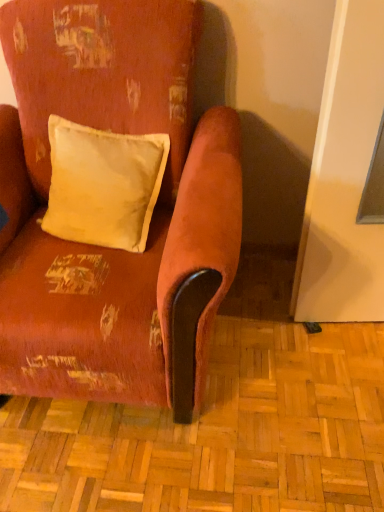
Image resolution: width=384 pixels, height=512 pixels. I want to click on distressed velvet armchair at center, so click(x=151, y=217).

What do you see at coordinates (151, 217) in the screenshot? I see `distressed velvet armchair at center` at bounding box center [151, 217].

Locate an element on the screen. The image size is (384, 512). matte yellow cushion at upper left is located at coordinates (103, 185).

Measure the distance between matte yellow cushion at upper left and camera.

A distance of 4.12 feet exists between matte yellow cushion at upper left and camera.

The height and width of the screenshot is (512, 384). What do you see at coordinates (103, 185) in the screenshot?
I see `matte yellow cushion at upper left` at bounding box center [103, 185].

Locate an element on the screen. distressed velvet armchair at center is located at coordinates (151, 217).

Can you confirm if matte yellow cushion at upper left is positioned to the left of distressed velvet armchair at center?

Incorrect, matte yellow cushion at upper left is not on the left side of distressed velvet armchair at center.

Considering the positions of objects matte yellow cushion at upper left and distressed velvet armchair at center in the image provided, who is in front, matte yellow cushion at upper left or distressed velvet armchair at center?

distressed velvet armchair at center is closer to the camera.

Is point (93, 161) behind point (94, 255)?

Yes, point (93, 161) is farther from viewer.

From the image's perspective, does matte yellow cushion at upper left appear higher than distressed velvet armchair at center?

Indeed, from the image's perspective, matte yellow cushion at upper left is shown above distressed velvet armchair at center.

From a real-world perspective, which object rests below the other?

distressed velvet armchair at center.

Is matte yellow cushion at upper left wider than distressed velvet armchair at center?

No, matte yellow cushion at upper left is not wider than distressed velvet armchair at center.

Does matte yellow cushion at upper left have a lesser height compared to distressed velvet armchair at center?

Yes.

Based on their sizes in the image, would you say matte yellow cushion at upper left is bigger or smaller than distressed velvet armchair at center?

In the image, matte yellow cushion at upper left appears to be smaller than distressed velvet armchair at center.

Is matte yellow cushion at upper left inside the boundaries of distressed velvet armchair at center, or outside?

matte yellow cushion at upper left is inside distressed velvet armchair at center.

Are matte yellow cushion at upper left and distressed velvet armchair at center located far from each other?

No, matte yellow cushion at upper left is in close proximity to distressed velvet armchair at center.

Is matte yellow cushion at upper left oriented away from distressed velvet armchair at center?

Yes, matte yellow cushion at upper left's orientation is away from distressed velvet armchair at center.

Measure the distance between matte yellow cushion at upper left and distressed velvet armchair at center.

matte yellow cushion at upper left and distressed velvet armchair at center are 6.63 inches apart.

Locate an element on the screen. This screenshot has height=512, width=384. pillow positioned vertically above the distressed velvet armchair at center (from a real-world perspective) is located at coordinates (103, 185).

Based on their positions, is distressed velvet armchair at center located to the left or right of matte yellow cushion at upper left?

distressed velvet armchair at center is to the left of matte yellow cushion at upper left.

Considering the positions of objects distressed velvet armchair at center and matte yellow cushion at upper left in the image provided, who is behind, distressed velvet armchair at center or matte yellow cushion at upper left?

Positioned behind is matte yellow cushion at upper left.

Is point (174, 30) closer or farther from the camera than point (112, 226)?

Clearly, point (174, 30) is closer to the camera than point (112, 226).

From the image's perspective, is distressed velvet armchair at center below matte yellow cushion at upper left?

Yes, from the image's perspective, distressed velvet armchair at center is below matte yellow cushion at upper left.

From a real-world perspective, is distressed velvet armchair at center physically located above or below matte yellow cushion at upper left?

distressed velvet armchair at center is below matte yellow cushion at upper left.

Considering the sizes of distressed velvet armchair at center and matte yellow cushion at upper left in the image, is distressed velvet armchair at center wider or thinner than matte yellow cushion at upper left?

Considering their sizes, distressed velvet armchair at center looks broader than matte yellow cushion at upper left.

Can you confirm if distressed velvet armchair at center is taller than matte yellow cushion at upper left?

Yes, distressed velvet armchair at center is taller than matte yellow cushion at upper left.

Can you confirm if distressed velvet armchair at center is smaller than matte yellow cushion at upper left?

Incorrect, distressed velvet armchair at center is not smaller in size than matte yellow cushion at upper left.

Is distressed velvet armchair at center spatially inside matte yellow cushion at upper left, or outside of it?

The correct answer is: outside.

Is distressed velvet armchair at center placed right next to matte yellow cushion at upper left?

No, distressed velvet armchair at center is not touching matte yellow cushion at upper left.

Is matte yellow cushion at upper left at the back of distressed velvet armchair at center?

Correct, distressed velvet armchair at center is looking away from matte yellow cushion at upper left.

How much distance is there between distressed velvet armchair at center and matte yellow cushion at upper left?

distressed velvet armchair at center and matte yellow cushion at upper left are 6.63 inches apart.

I want to click on chair lying on the left of matte yellow cushion at upper left, so click(x=151, y=217).

Identify the location of pillow above the distressed velvet armchair at center (from the image's perspective). (103, 185).

What are the coordinates of `chair below the matte yellow cushion at upper left (from the image's perspective)` in the screenshot? It's located at (151, 217).